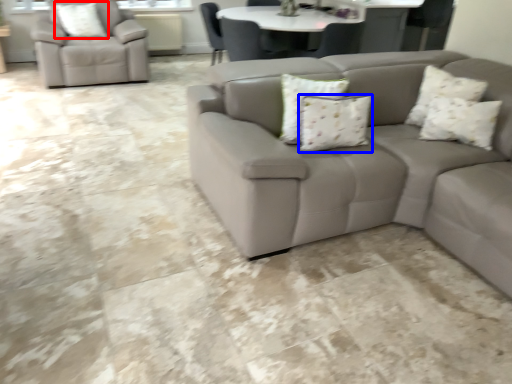
Question: Which object is further to the camera taking this photo, pillow (highlighted by a red box) or pillow (highlighted by a blue box)?

Choices:
 (A) pillow
 (B) pillow

Answer: (A)